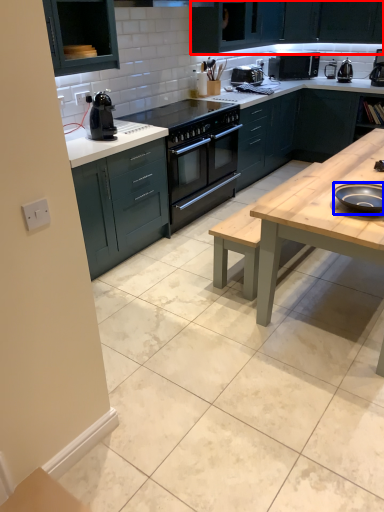
Question: Which point is further to the camera, cabinetry (highlighted by a red box) or appliance (highlighted by a blue box)?

Choices:
 (A) cabinetry
 (B) appliance

Answer: (A)